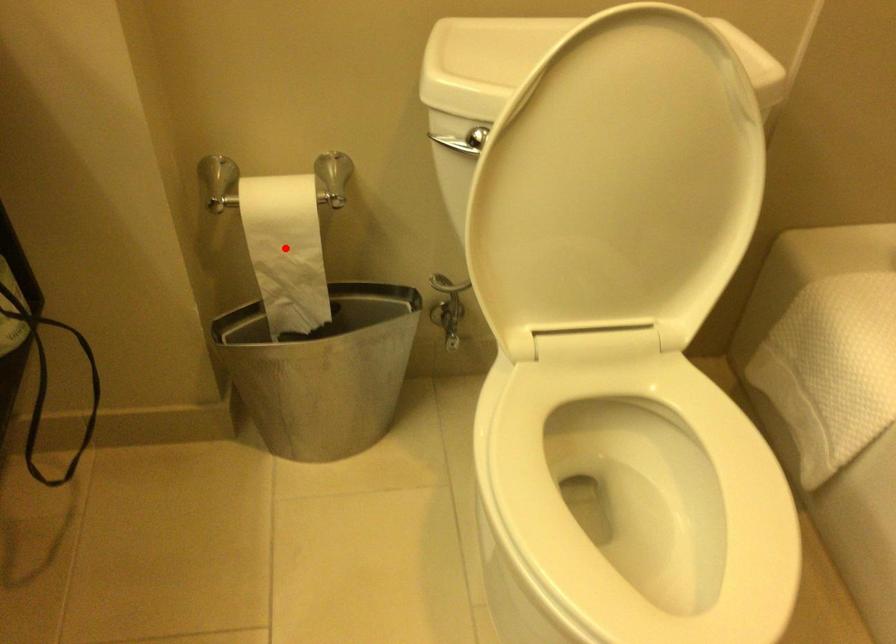
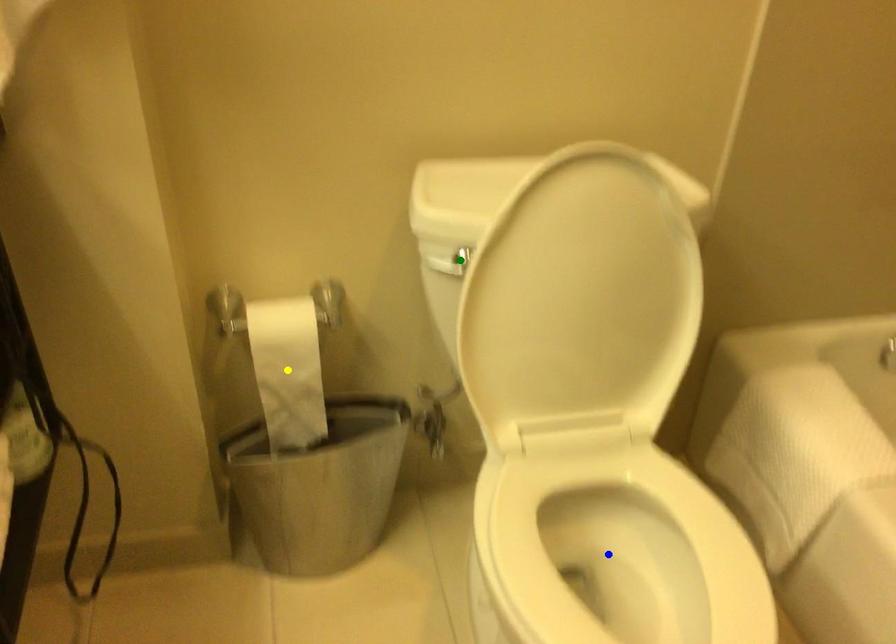
Question: I am providing you with two images of the same scene from different viewpoints. A red point is marked on the first image. You are given multiple points on the second image. Which point in image 2 is actually the same real-world point as the red point in image 1?

Choices:
 (A) yellow point
 (B) green point
 (C) blue point

Answer: (A)